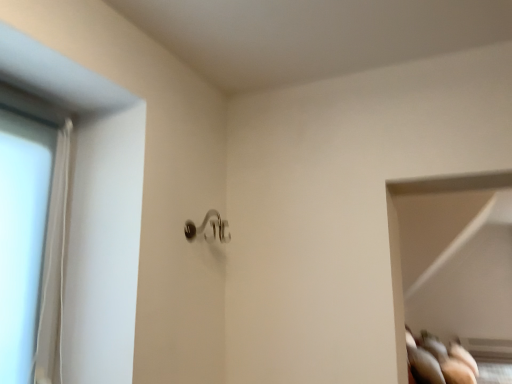
What do you see at coordinates (22, 236) in the screenshot? I see `transparent glass door at left` at bounding box center [22, 236].

Where is `transparent glass door at left`? transparent glass door at left is located at coordinates (22, 236).

What do you see at coordinates (210, 225) in the screenshot? The width and height of the screenshot is (512, 384). I see `satin nickel door handle at center` at bounding box center [210, 225].

What is the approximate width of satin nickel door handle at center?

6.88 inches.

The height and width of the screenshot is (384, 512). I want to click on satin nickel door handle at center, so click(x=210, y=225).

This screenshot has height=384, width=512. I want to click on transparent glass door at left, so click(22, 236).

Can you confirm if transparent glass door at left is positioned to the right of satin nickel door handle at center?

In fact, transparent glass door at left is to the left of satin nickel door handle at center.

Is transparent glass door at left positioned in front of satin nickel door handle at center?

Yes, it is.

Is point (4, 243) farther from viewer compared to point (192, 238)?

No, (4, 243) is in front of (192, 238).

Consider the image. From the image's perspective, is transparent glass door at left positioned above or below satin nickel door handle at center?

From the image's perspective, transparent glass door at left appears below satin nickel door handle at center.

From a real-world perspective, which object rests below the other?

In real-world perspective, transparent glass door at left is lower.

Which object is thinner, transparent glass door at left or satin nickel door handle at center?

transparent glass door at left is thinner.

Between transparent glass door at left and satin nickel door handle at center, which one has more height?

With more height is transparent glass door at left.

Who is bigger, transparent glass door at left or satin nickel door handle at center?

Bigger between the two is transparent glass door at left.

Would you say transparent glass door at left contains satin nickel door handle at center?

That's incorrect, satin nickel door handle at center is not inside transparent glass door at left.

Is transparent glass door at left next to satin nickel door handle at center?

No, transparent glass door at left is not in contact with satin nickel door handle at center.

Is satin nickel door handle at center at the back of transparent glass door at left?

That's not correct — transparent glass door at left is not looking away from satin nickel door handle at center.

What's the angular difference between transparent glass door at left and satin nickel door handle at center's facing directions?

The facing directions of transparent glass door at left and satin nickel door handle at center are 1.35 degrees apart.

Where is `door handle located above the transparent glass door at left (from the image's perspective)`? Image resolution: width=512 pixels, height=384 pixels. door handle located above the transparent glass door at left (from the image's perspective) is located at coordinates (210, 225).

Can you confirm if satin nickel door handle at center is positioned to the left of transparent glass door at left?

In fact, satin nickel door handle at center is to the right of transparent glass door at left.

Is the depth of satin nickel door handle at center less than that of transparent glass door at left?

No, satin nickel door handle at center is further to the viewer.

Between point (208, 220) and point (15, 304), which one is positioned behind?

Positioned behind is point (208, 220).

From the image's perspective, which one is positioned lower, satin nickel door handle at center or transparent glass door at left?

transparent glass door at left, from the image's perspective.

From a real-world perspective, is satin nickel door handle at center physically below transparent glass door at left?

Actually, satin nickel door handle at center is physically above transparent glass door at left in the real world.

Is satin nickel door handle at center wider than transparent glass door at left?

Indeed, satin nickel door handle at center has a greater width compared to transparent glass door at left.

Considering the sizes of objects satin nickel door handle at center and transparent glass door at left in the image provided, who is taller, satin nickel door handle at center or transparent glass door at left?

With more height is transparent glass door at left.

Between satin nickel door handle at center and transparent glass door at left, which one has smaller size?

With smaller size is satin nickel door handle at center.

Is satin nickel door handle at center inside the boundaries of transparent glass door at left, or outside?

satin nickel door handle at center lies outside transparent glass door at left.

Are satin nickel door handle at center and transparent glass door at left located far from each other?

Actually, satin nickel door handle at center and transparent glass door at left are a little close together.

Is satin nickel door handle at center positioned with its back to transparent glass door at left?

No, satin nickel door handle at center is not facing away from transparent glass door at left.

How many degrees apart are the facing directions of satin nickel door handle at center and transparent glass door at left?

Answer: 1.35 degrees.

Find the location of `glass door lying in front of the satin nickel door handle at center`. glass door lying in front of the satin nickel door handle at center is located at coordinates (22, 236).

I want to click on glass door in front of the satin nickel door handle at center, so click(x=22, y=236).

Where is `glass door that appears below the satin nickel door handle at center (from the image's perspective)`? The height and width of the screenshot is (384, 512). glass door that appears below the satin nickel door handle at center (from the image's perspective) is located at coordinates (x=22, y=236).